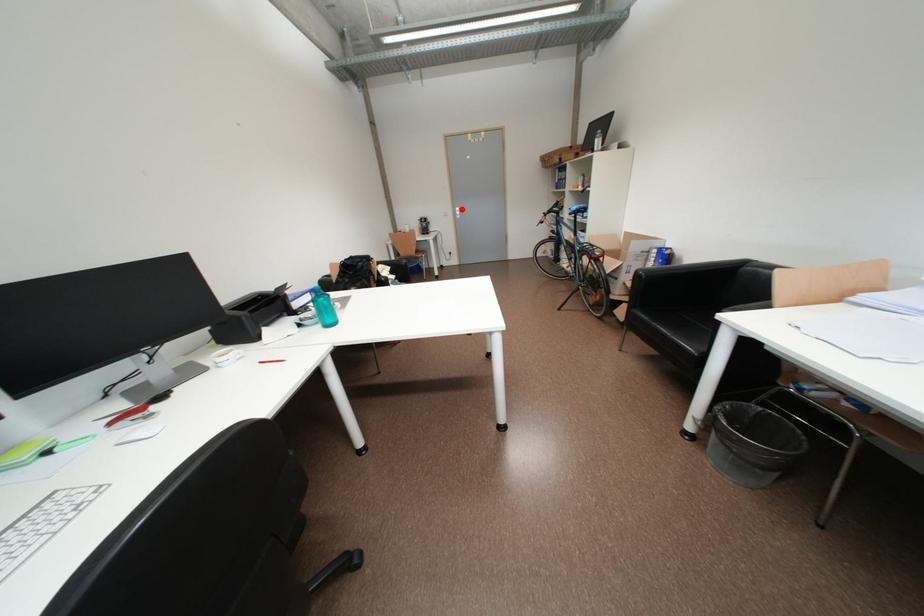
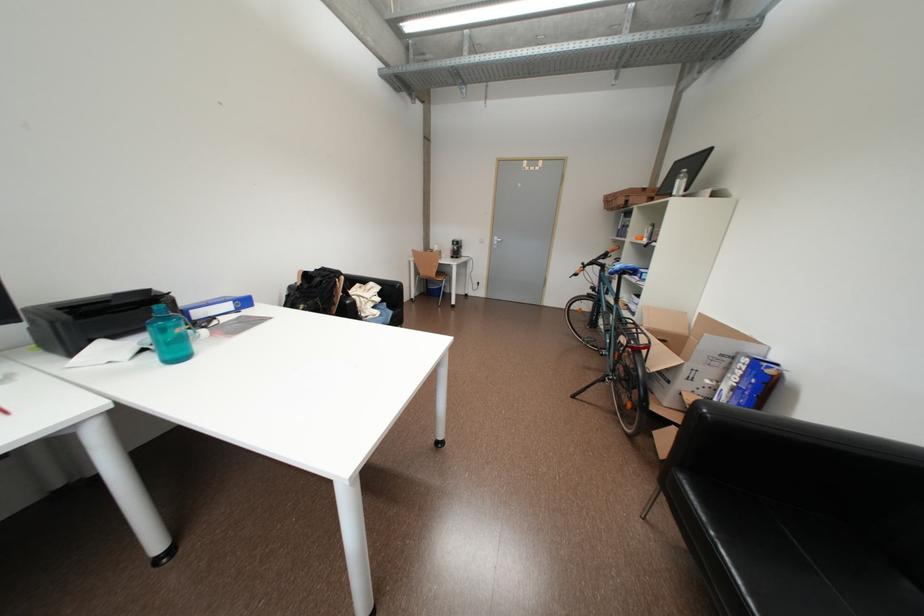
In the second image, find the point that corresponds to the highlighted location in the first image.

(500, 238)